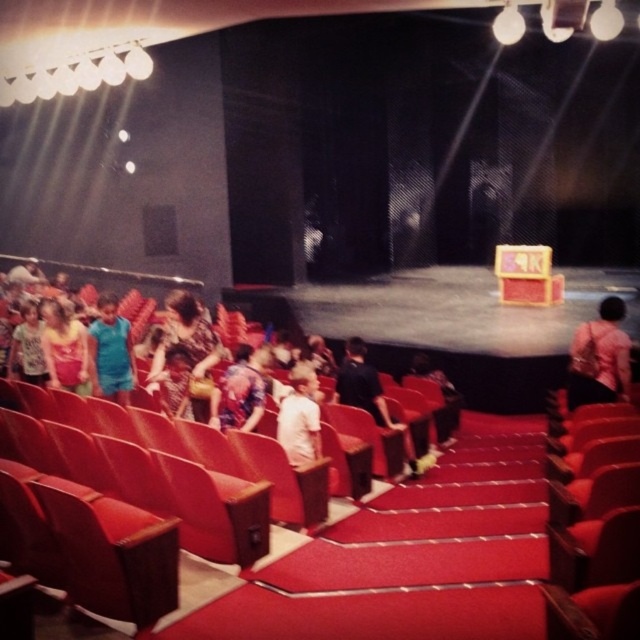
Question: Is floral fabric dress at center to the left of matte white shirt at center from the viewer's perspective?

Choices:
 (A) yes
 (B) no

Answer: (B)

Question: Which point appears closest to the camera in this image?

Choices:
 (A) (92, 372)
 (B) (104, 269)
 (C) (579, 396)

Answer: (C)

Question: Which of these objects is positioned farthest from the pink fabric purse at center?

Choices:
 (A) matte white shirt at center
 (B) floral fabric dress at center

Answer: (A)

Question: Which point is closer to the camera?

Choices:
 (A) matte pink dress at left
 (B) blue fabric shirt at center
 (C) pink fabric purse at center

Answer: (C)

Question: Does floral fabric dress at center appear on the right side of matte white shirt at center?

Choices:
 (A) yes
 (B) no

Answer: (A)

Question: Is pink fabric purse at center wider than blue fabric shirt at center?

Choices:
 (A) yes
 (B) no

Answer: (A)